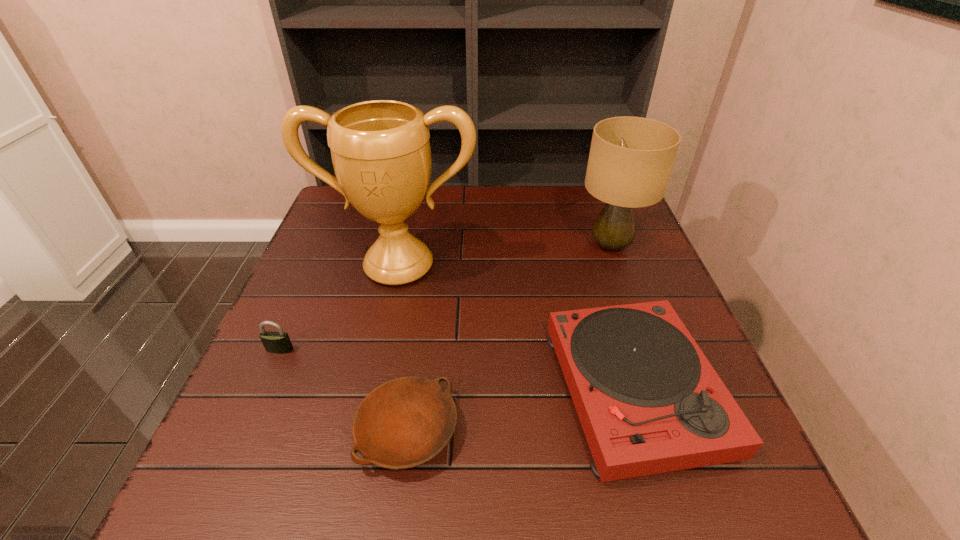
The height and width of the screenshot is (540, 960). In order to click on free space that is in between the award and the record player in this screenshot , I will do `click(516, 328)`.

Locate an element on the screen. free space between the tallest object and the record player is located at coordinates (516, 328).

Identify the location of vacant area that lies between the padlock and the record player. 457,370.

You are a GUI agent. You are given a task and a screenshot of the screen. Output one action in this format:
    pyautogui.click(x=<x>, y=<y>)
    Task: Click on the free space between the padlock and the lampshade
    The image size is (960, 540).
    Given the screenshot: What is the action you would take?
    pyautogui.click(x=445, y=298)

Identify which object is located as the second nearest to the award. Please provide its 2D coordinates. Your answer should be formatted as a tuple, i.e. [(x, y)], where the tuple contains the x and y coordinates of a point satisfying the conditions above.

[(649, 401)]

In order to click on object that stands as the fourth closest to the padlock in this screenshot , I will do `click(631, 158)`.

At what (x,y) coordinates should I click in order to perform the action: click on free space that satisfies the following two spatial constraints: 1. on the front of the award with the decoration; 2. on the right side of the record player. Please return your answer as a coordinate pair (x, y). The height and width of the screenshot is (540, 960). Looking at the image, I should click on (372, 391).

This screenshot has width=960, height=540. Identify the location of free space that satisfies the following two spatial constraints: 1. on the front of the award with the decoration; 2. on the right side of the record player. (372, 391).